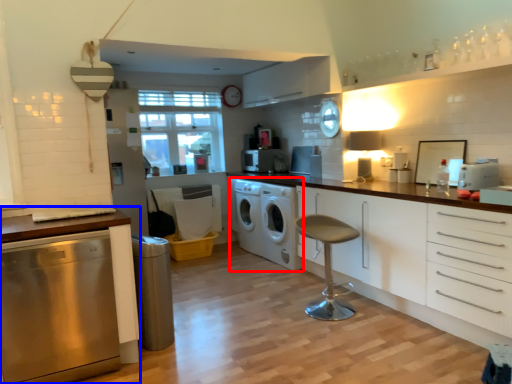
Question: Which point is further to the camera, washing machine (highlighted by a red box) or cabinetry (highlighted by a blue box)?

Choices:
 (A) washing machine
 (B) cabinetry

Answer: (A)